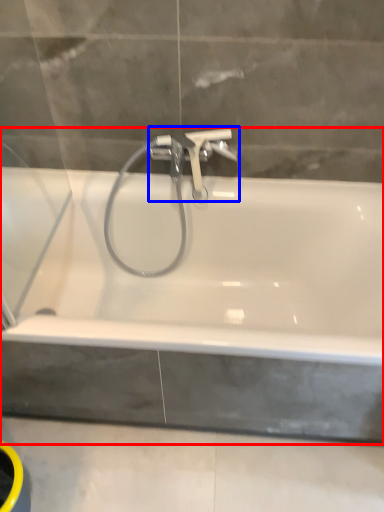
Question: Which of the following is the closest to the observer, bathtub (highlighted by a red box) or tap (highlighted by a blue box)?

Choices:
 (A) bathtub
 (B) tap

Answer: (A)